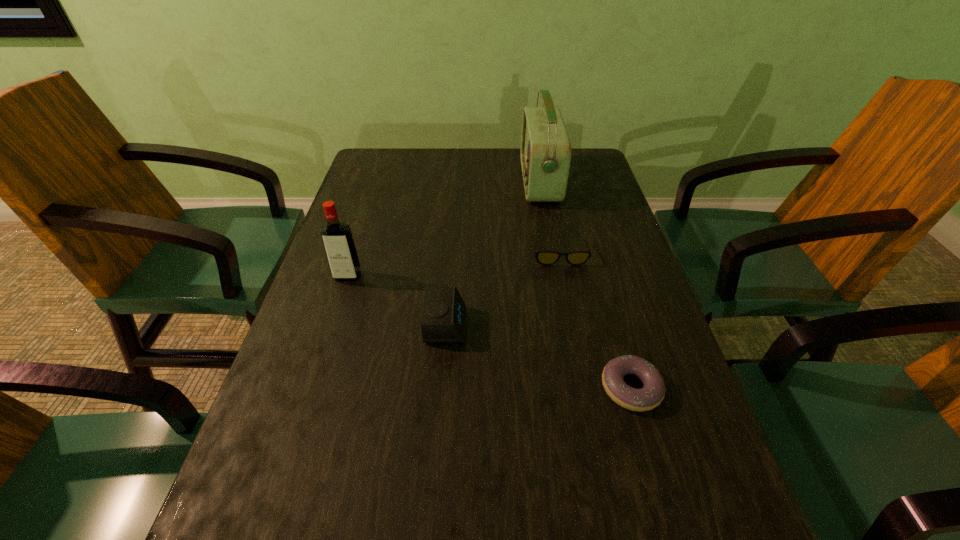
Where is `object at the far right corner`? object at the far right corner is located at coordinates (545, 154).

The height and width of the screenshot is (540, 960). In the image, there is a desktop. Identify the location of vacant space at the far edge. (455, 156).

Identify the location of free space at the left edge of the desktop. Image resolution: width=960 pixels, height=540 pixels. (351, 362).

The width and height of the screenshot is (960, 540). In the image, there is a desktop. Find the location of `vacant space at the right edge`. vacant space at the right edge is located at coordinates (608, 210).

You are a GUI agent. You are given a task and a screenshot of the screen. Output one action in this format:
    pyautogui.click(x=<x>, y=<y>)
    Task: Click on the vacant space at the far left corner of the desktop
    This screenshot has height=540, width=960.
    Given the screenshot: What is the action you would take?
    point(405,172)

I want to click on vacant region between the second nearest object and the fourth nearest object, so click(x=503, y=291).

Identify the location of free point between the farthest object and the fourth shortest object. (444, 229).

I want to click on free space between the second farthest object and the leftmost object, so click(454, 266).

The height and width of the screenshot is (540, 960). Find the location of `free spot between the fourth farthest object and the fourth shortest object`. free spot between the fourth farthest object and the fourth shortest object is located at coordinates (397, 301).

You are a GUI agent. You are given a task and a screenshot of the screen. Output one action in this format:
    pyautogui.click(x=<x>, y=<y>)
    Task: Click on the vacant space in between the nearest object and the vodka
    The image size is (960, 540).
    Given the screenshot: What is the action you would take?
    pyautogui.click(x=490, y=332)